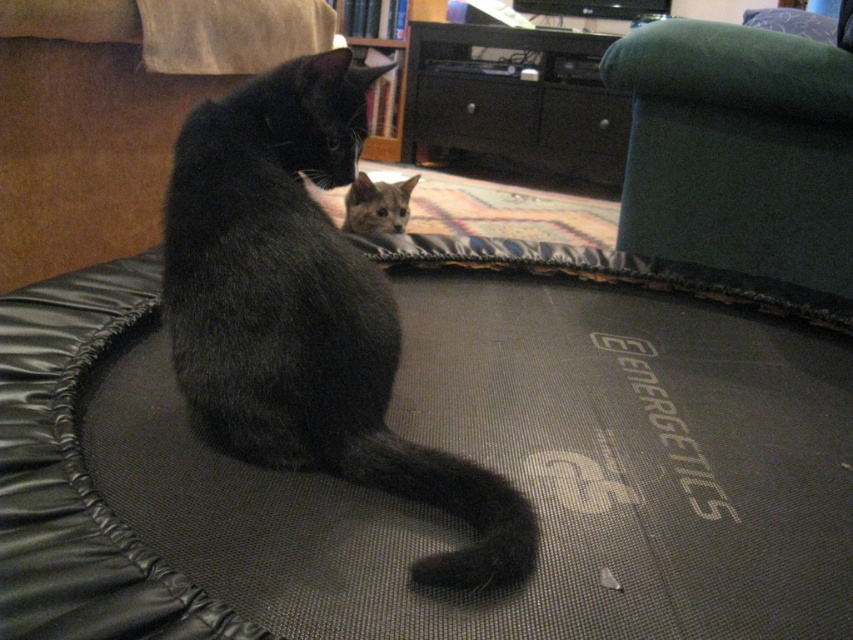
You are a cat owner trying to place a new cat tree in your living room. You want to ensure it won t block the path between the black matte fur cat at center and the black fabric dog bed at center. Given that the cat tree is 30 cm wide, can you fit it in the space between them?

The black matte fur cat at center is thinner than the black fabric dog bed at center. However, the description does not provide information about the distance between them. Therefore, it is impossible to determine if the 30 cm wide cat tree can fit in the space between them.

You are a photographer trying to capture both the black matte fur cat at center and the green fabric bean bag at upper right in the same frame. Which object is closer to the camera and will appear larger in the photo?

The black matte fur cat at center is closer to the viewer, so it will appear larger in the photo than the green fabric bean bag at upper right.

You are a cat owner who wants to place a new toy between the black matte fur cat at center and the black fabric dog bed at center. Based on their positions, which side of the dog bed should you place the toy to ensure it is between them?

The black matte fur cat at center is to the right of the black fabric dog bed at center, so you should place the toy to the right side of the black fabric dog bed at center to keep it between them.